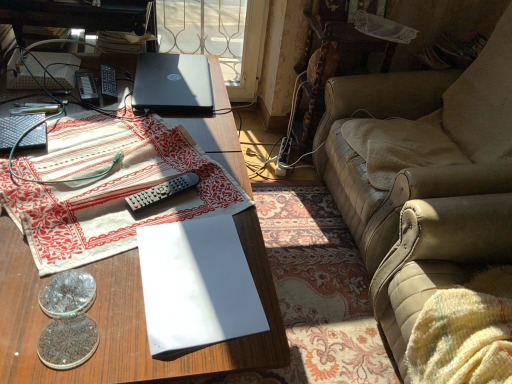
This screenshot has width=512, height=384. Find the location of `free space to the right of black plastic remote control at upper left, the 3th remote control from the right`. free space to the right of black plastic remote control at upper left, the 3th remote control from the right is located at coordinates (141, 99).